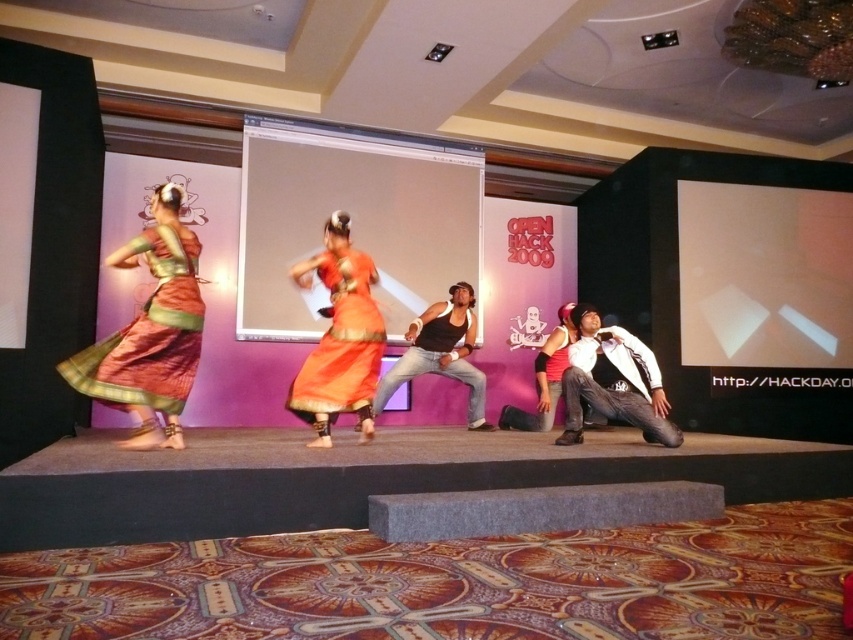
You are a photographer at the OPEN HACK 2009 event and want to capture the orange silk dress at center. Where should you focus your camera to ensure the point at coordinates (341, 340) is in the frame?

The point at coordinates (341, 340) is on the orange silk dress at center, so focusing the camera on the orange silk dress at center will ensure the point is in the frame.

You are an event coordinator trying to position a microphone stand for the dancer wearing the silky orange saree at left. According to the stage setup, where should you place the microphone stand relative to her position?

The silky orange saree at left is located at point [149,333], so the microphone stand should be placed near that coordinate to ensure it is accessible to the dancer.